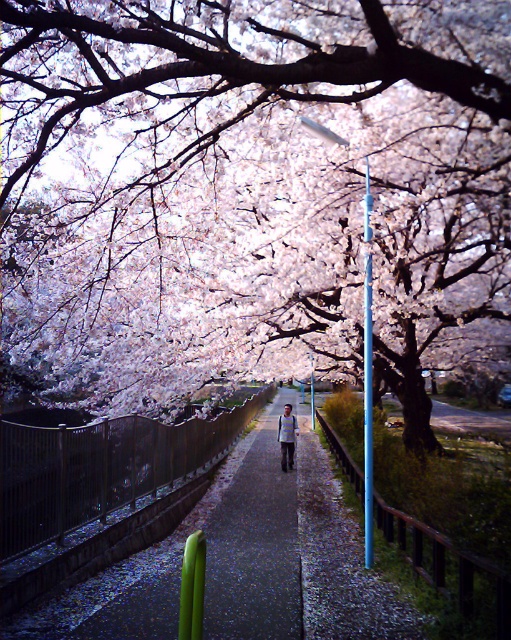
You are a photographer standing at the end of the pathway. You want to take a photo of both the fluffy pink blossoms at center and the smooth plastic pole at center. Which object will appear larger in the photo?

The fluffy pink blossoms at center will appear larger in the photo because they are much taller than the smooth plastic pole at center.

You are standing on the pathway and want to take a photo of the fluffy pink blossoms at center and the light blue striped shirt at center. Which object should you zoom in more on to capture both in the frame?

You should zoom in more on the light blue striped shirt at center because the fluffy pink blossoms at center are wider, so zooming in on the smaller object allows both to fit in the frame.

You are a photographer planning to capture the pathway under the cherry blossoms. You notice the fluffy pink blossoms at center and the smooth plastic pole at center. Which object would appear wider in your photo?

The fluffy pink blossoms at center would appear wider in the photo since their width is larger than the smooth plastic pole at center.